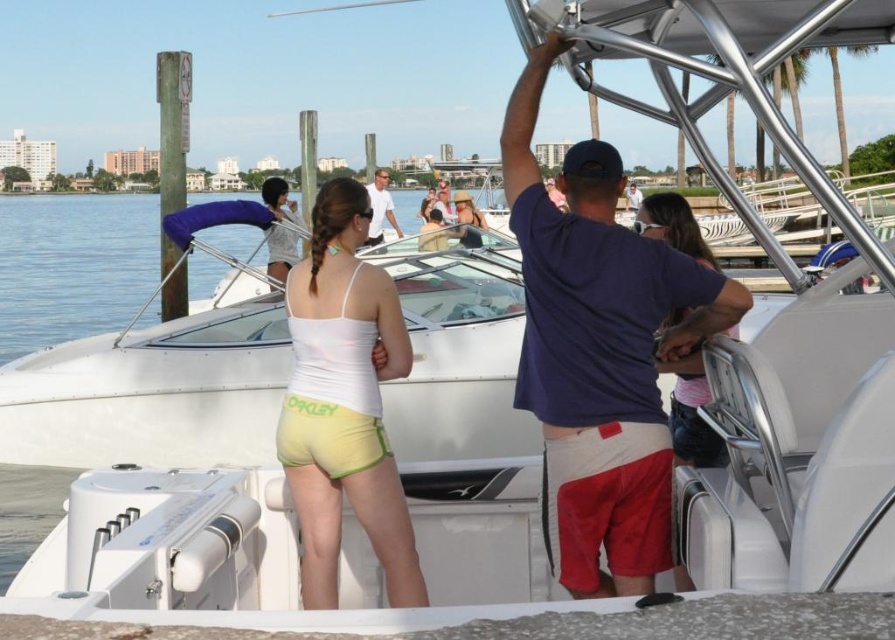
Question: Where is white matte tank top at center located in relation to matte blue shirt at center in the image?

Choices:
 (A) right
 (B) left

Answer: (B)

Question: Which point is farther from the camera taking this photo?

Choices:
 (A) (573, 461)
 (B) (371, 266)

Answer: (B)

Question: Is matte white blouse at center in front of matte yellow bikini top at center?

Choices:
 (A) yes
 (B) no

Answer: (B)

Question: Estimate the real-world distances between objects in this image. Which object is closer to the matte white blouse at center?

Choices:
 (A) white matte tank top at center
 (B) matte blue shirt at center
 (C) matte purple shirt at center

Answer: (A)

Question: Is matte white blouse at center further to the viewer compared to matte blue shirt at center?

Choices:
 (A) yes
 (B) no

Answer: (B)

Question: Which point is closer to the camera?

Choices:
 (A) pink fabric shirt at center
 (B) matte white blouse at center
 (C) matte beige sunglasses at center

Answer: (A)